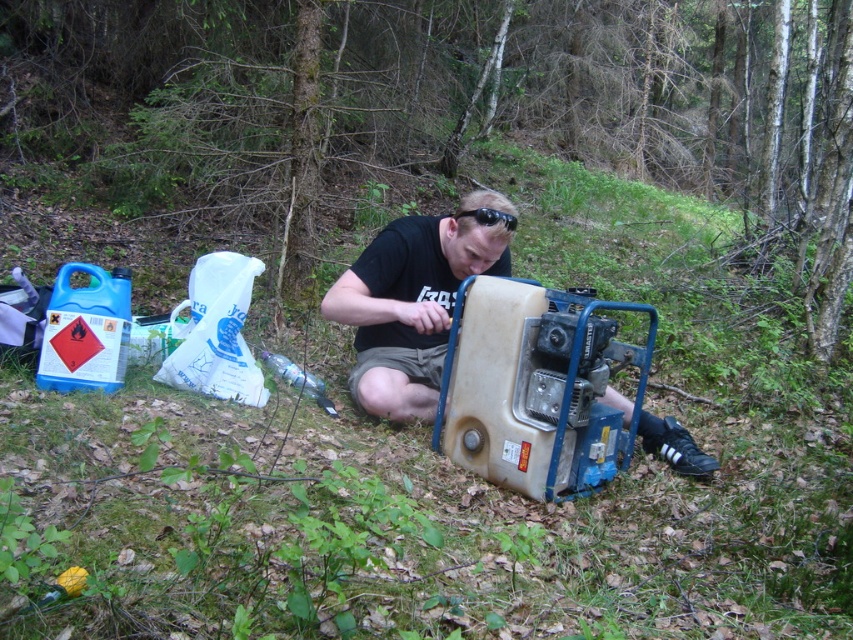
Can you confirm if beige plastic generator at center is positioned to the right of matte black generator at center?

Yes, beige plastic generator at center is to the right of matte black generator at center.

Between beige plastic generator at center and matte black generator at center, which one is positioned higher?

matte black generator at center is higher up.

Does point (526, 493) come in front of point (396, 397)?

Yes, point (526, 493) is in front of point (396, 397).

The image size is (853, 640). What are the coordinates of `beige plastic generator at center` in the screenshot? It's located at (535, 387).